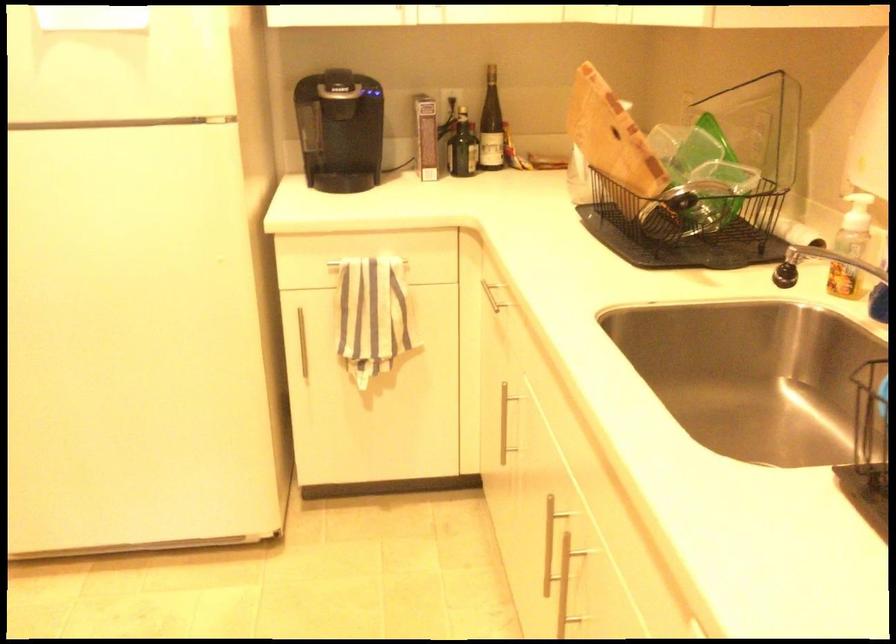
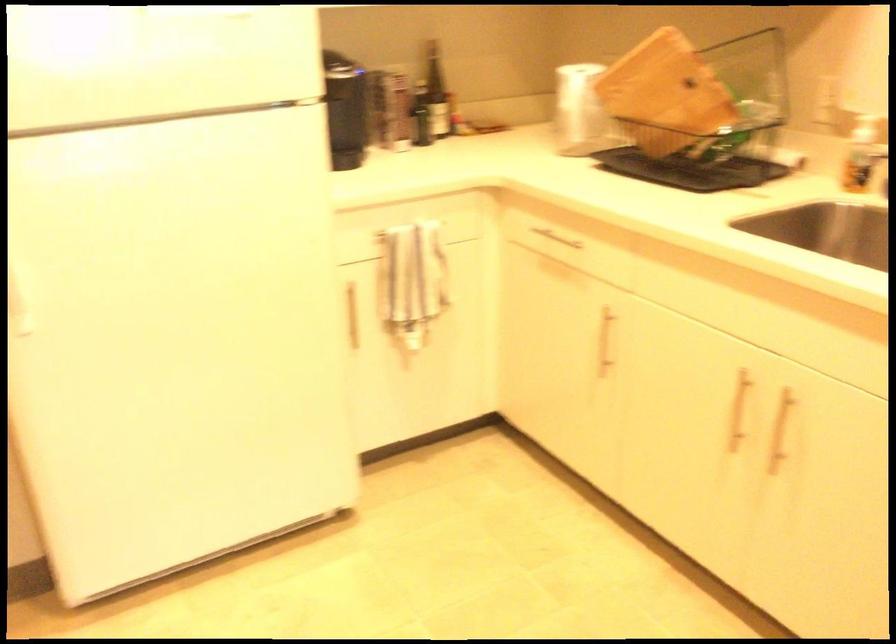
In the second image, find the point that corresponds to point 509,429 in the first image.

(605, 341)